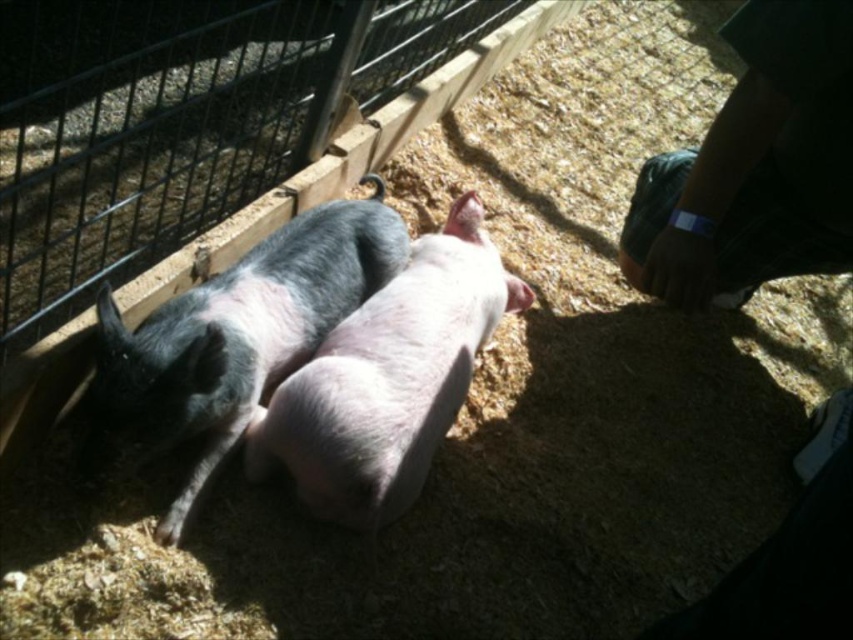
Can you confirm if gray matte pig at center is positioned above pink smooth pig at center?

Yes.

Based on the photo, who is positioned more to the left, gray matte pig at center or pink smooth pig at center?

Positioned to the left is gray matte pig at center.

Does point (229, 448) lie in front of point (265, 416)?

No.

Identify the location of gray matte pig at center. The image size is (853, 640). (233, 339).